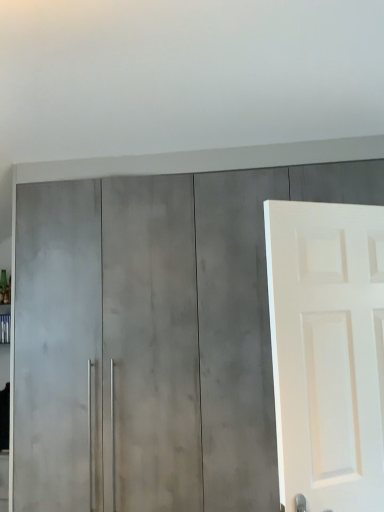
Locate an element on the screen. satin gray cabinet at center is located at coordinates click(154, 335).

Measure the distance between point [86,194] and camera.

Point [86,194] and camera are 2.08 meters apart from each other.

This screenshot has height=512, width=384. What do you see at coordinates (154, 335) in the screenshot?
I see `satin gray cabinet at center` at bounding box center [154, 335].

Identify the location of white matte door at right. Image resolution: width=384 pixels, height=512 pixels. (327, 352).

The width and height of the screenshot is (384, 512). What do you see at coordinates (327, 352) in the screenshot?
I see `white matte door at right` at bounding box center [327, 352].

The height and width of the screenshot is (512, 384). In order to click on satin gray cabinet at center in this screenshot , I will do `click(154, 335)`.

Based on the photo, between satin gray cabinet at center and white matte door at right, which one appears on the left side from the viewer's perspective?

satin gray cabinet at center.

From the picture: Considering the relative positions of satin gray cabinet at center and white matte door at right in the image provided, is satin gray cabinet at center behind white matte door at right?

Yes, the depth of satin gray cabinet at center is greater than that of white matte door at right.

Considering the positions of points (199, 192) and (344, 381), is point (199, 192) farther from camera compared to point (344, 381)?

Yes, point (199, 192) is behind point (344, 381).

From the image's perspective, is satin gray cabinet at center below white matte door at right?

Yes.

Looking at this image, from a real-world perspective, is satin gray cabinet at center physically located above or below white matte door at right?

satin gray cabinet at center is below white matte door at right.

Which of these two, satin gray cabinet at center or white matte door at right, is wider?

satin gray cabinet at center is wider.

Between satin gray cabinet at center and white matte door at right, which one has less height?

With less height is white matte door at right.

Considering the relative sizes of satin gray cabinet at center and white matte door at right in the image provided, is satin gray cabinet at center smaller than white matte door at right?

No.

From the picture: Do you think satin gray cabinet at center is within white matte door at right, or outside of it?

satin gray cabinet at center is not inside white matte door at right, it's outside.

Would you consider satin gray cabinet at center to be distant from white matte door at right?

satin gray cabinet at center is near white matte door at right, not far away.

Does satin gray cabinet at center turn towards white matte door at right?

Yes, satin gray cabinet at center is facing white matte door at right.

What's the angular difference between satin gray cabinet at center and white matte door at right's facing directions?

satin gray cabinet at center and white matte door at right are facing 25.5 degrees away from each other.

How distant is satin gray cabinet at center from white matte door at right?

satin gray cabinet at center is 22.91 inches away from white matte door at right.

Find the location of a particular element. cupboard that is behind the white matte door at right is located at coordinates (154, 335).

Considering the positions of objects white matte door at right and satin gray cabinet at center in the image provided, who is more to the left, white matte door at right or satin gray cabinet at center?

satin gray cabinet at center.

Is the depth of white matte door at right less than that of satin gray cabinet at center?

Yes, white matte door at right is in front of satin gray cabinet at center.

Does point (370, 437) lie in front of point (137, 411)?

Yes, it is in front of point (137, 411).

From the image's perspective, is white matte door at right above satin gray cabinet at center?

Yes, from the image's perspective, white matte door at right is over satin gray cabinet at center.

From a real-world perspective, which is physically above, white matte door at right or satin gray cabinet at center?

white matte door at right.

Considering the sizes of objects white matte door at right and satin gray cabinet at center in the image provided, who is wider, white matte door at right or satin gray cabinet at center?

satin gray cabinet at center is wider.

Considering the sizes of white matte door at right and satin gray cabinet at center in the image, is white matte door at right taller or shorter than satin gray cabinet at center?

Clearly, white matte door at right is shorter compared to satin gray cabinet at center.

Can you confirm if white matte door at right is smaller than satin gray cabinet at center?

Correct, white matte door at right occupies less space than satin gray cabinet at center.

Is white matte door at right outside of satin gray cabinet at center?

Yes, white matte door at right is not within satin gray cabinet at center.

Would you say white matte door at right is a long distance from satin gray cabinet at center?

white matte door at right is actually quite close to satin gray cabinet at center.

Is white matte door at right aimed at satin gray cabinet at center?

No, white matte door at right is not facing towards satin gray cabinet at center.

Image resolution: width=384 pixels, height=512 pixels. I want to click on cupboard on the left side of white matte door at right, so click(154, 335).

Identify the location of cupboard below the white matte door at right (from the image's perspective). tap(154, 335).

Locate an element on the screen. cupboard on the left of white matte door at right is located at coordinates (154, 335).